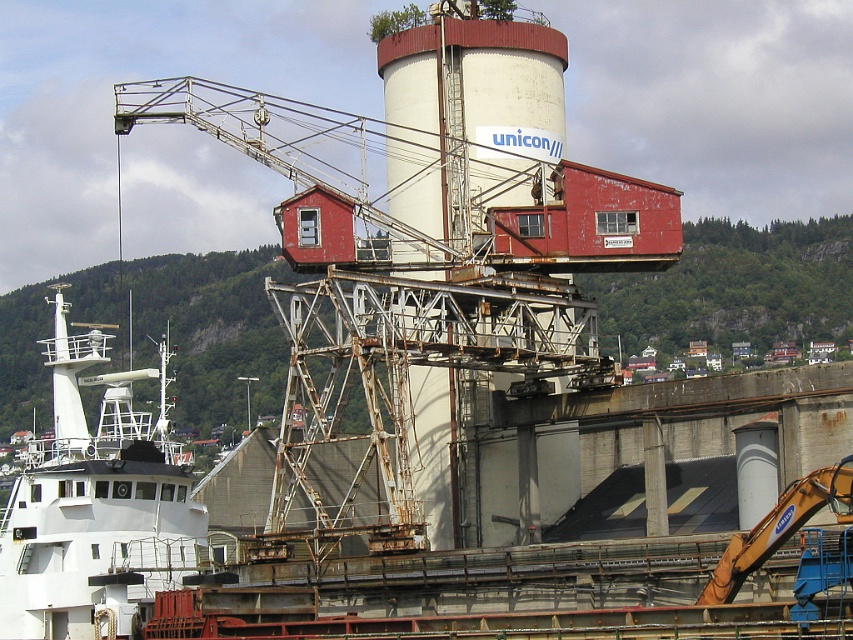
Which is more to the left, white matte tower at center or white matte boat at lower left?

white matte boat at lower left is more to the left.

Is point (544, 92) closer to viewer compared to point (86, 476)?

No, it is not.

Where is `white matte tower at center`? The image size is (853, 640). white matte tower at center is located at coordinates (469, 109).